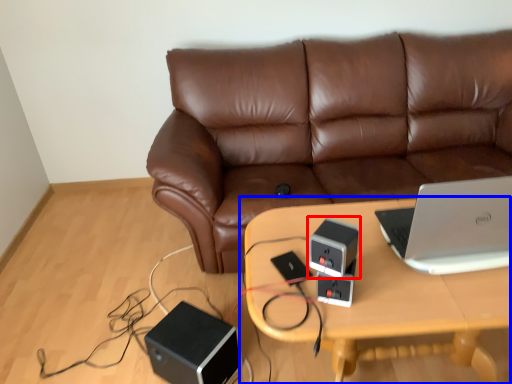
Question: Which object is closer to the camera taking this photo, speaker (highlighted by a red box) or table (highlighted by a blue box)?

Choices:
 (A) speaker
 (B) table

Answer: (A)